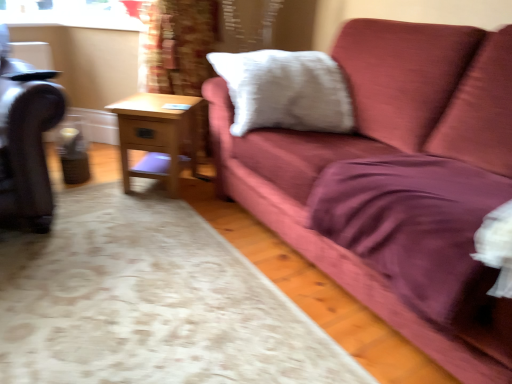
Question: Does point (195, 155) appear closer or farther from the camera than point (10, 185)?

Choices:
 (A) closer
 (B) farther

Answer: (B)

Question: In the image, is wooden side table at center on the left side or the right side of leather swivel chair at left?

Choices:
 (A) left
 (B) right

Answer: (B)

Question: Estimate the real-world distances between objects in this image. Which object is closer to the leather swivel chair at left?

Choices:
 (A) wooden side table at center
 (B) white soft pillow at upper center

Answer: (A)

Question: Which of these objects is positioned farthest from the wooden side table at center?

Choices:
 (A) white soft pillow at upper center
 (B) leather swivel chair at left

Answer: (B)